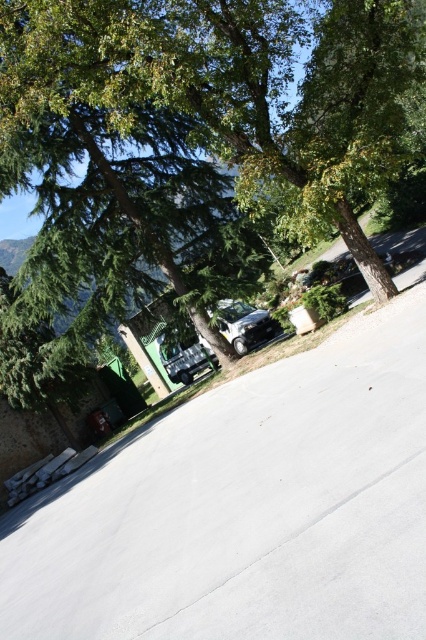
You are a delivery person needing to park your 15 feet long truck between the green leafy tree at upper left and the satin silver car at center. Can you fit your truck there?

The distance between the green leafy tree at upper left and the satin silver car at center is 18.04 feet. Since your truck is 15 feet long, it can fit in the available space.